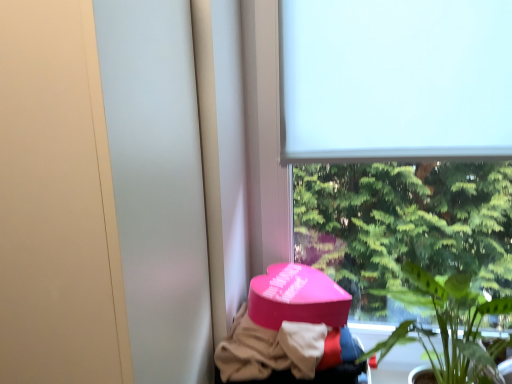
The width and height of the screenshot is (512, 384). Identify the location of white matte window at upper center. (387, 76).

What do you see at coordinates (449, 329) in the screenshot? The image size is (512, 384). I see `green leafy plant at lower right` at bounding box center [449, 329].

The width and height of the screenshot is (512, 384). I want to click on white matte window at upper center, so click(x=387, y=76).

From the image's perspective, which one is positioned lower, white matte window screen at upper center or green leafy plant at lower right?

green leafy plant at lower right, from the image's perspective.

Which of these two, white matte window screen at upper center or green leafy plant at lower right, is smaller?

Smaller between the two is white matte window screen at upper center.

From a real-world perspective, is white matte window screen at upper center under green leafy plant at lower right?

Actually, white matte window screen at upper center is physically above green leafy plant at lower right in the real world.

Can you confirm if green leafy plant at lower right is shorter than white matte window screen at upper center?

No.

From the image's perspective, is green leafy plant at lower right below white matte window screen at upper center?

Yes, from the image's perspective, green leafy plant at lower right is below white matte window screen at upper center.

Is point (465, 331) closer or farther from the camera than point (443, 37)?

Point (465, 331) appears to be closer to the viewer than point (443, 37).

From the image's perspective, which one is positioned higher, white matte window screen at upper center or pink matte heart-shaped box at lower center?

white matte window screen at upper center, from the image's perspective.

Where is `clothing below the white matte window screen at upper center (from the image's perspective)`? This screenshot has height=384, width=512. clothing below the white matte window screen at upper center (from the image's perspective) is located at coordinates (287, 354).

Does white matte window screen at upper center have a lesser width compared to pink matte heart-shaped box at lower center?

Yes, white matte window screen at upper center is thinner than pink matte heart-shaped box at lower center.

From a real-world perspective, is white matte window screen at upper center on top of pink matte heart-shaped box at lower center?

Indeed, from a real-world perspective, white matte window screen at upper center stands above pink matte heart-shaped box at lower center.

Identify the location of window screen on the right of pink matte heart-shaped box at lower center. This screenshot has width=512, height=384. pos(395,79).

What's the angular difference between pink matte heart-shaped box at lower center and white matte window screen at upper center's facing directions?

The facing directions of pink matte heart-shaped box at lower center and white matte window screen at upper center are 0.55 degrees apart.

Is the position of pink matte heart-shaped box at lower center more distant than that of white matte window screen at upper center?

No, it is not.

In terms of height, does pink matte heart-shaped box at lower center look taller or shorter compared to white matte window screen at upper center?

Clearly, pink matte heart-shaped box at lower center is shorter compared to white matte window screen at upper center.

Considering the sizes of objects green leafy plant at lower right and white matte window at upper center in the image provided, who is shorter, green leafy plant at lower right or white matte window at upper center?

Standing shorter between the two is green leafy plant at lower right.

Is green leafy plant at lower right positioned in front of white matte window at upper center?

Yes, green leafy plant at lower right is closer to the camera.

From the image's perspective, is green leafy plant at lower right positioned above or below white matte window at upper center?

Based on their image positions, green leafy plant at lower right is located beneath white matte window at upper center.

Which is nearer, (404,338) or (421,95)?

The point (404,338) is closer to the camera.

From the image's perspective, is white matte window at upper center located above or below green leafy plant at lower right?

Clearly, from the image's perspective, white matte window at upper center is above green leafy plant at lower right.

Considering the sizes of objects white matte window at upper center and green leafy plant at lower right in the image provided, who is smaller, white matte window at upper center or green leafy plant at lower right?

green leafy plant at lower right is smaller.

Is green leafy plant at lower right a part of white matte window at upper center?

No, green leafy plant at lower right is located outside of white matte window at upper center.

Is white matte window at upper center oriented away from green leafy plant at lower right?

Yes, white matte window at upper center's orientation is away from green leafy plant at lower right.

Is pink matte heart-shaped box at lower center beside white matte window at upper center?

No, pink matte heart-shaped box at lower center is not making contact with white matte window at upper center.

Is pink matte heart-shaped box at lower center positioned with its back to white matte window at upper center?

Yes, pink matte heart-shaped box at lower center is positioned with its back facing white matte window at upper center.

From a real-world perspective, between pink matte heart-shaped box at lower center and white matte window at upper center, who is vertically higher?

From a 3D spatial view, white matte window at upper center is above.

Measure the distance between pink matte heart-shaped box at lower center and white matte window at upper center.

15.79 inches.

The image size is (512, 384). What are the coordinates of `window screen located on the left of green leafy plant at lower right` in the screenshot? It's located at (395, 79).

I want to click on window screen above the green leafy plant at lower right (from a real-world perspective), so click(395, 79).

In the scene shown: Which object lies further to the anchor point white matte window screen at upper center, pink matte heart-shaped box at lower center or green leafy plant at lower right?

pink matte heart-shaped box at lower center is positioned further to the anchor white matte window screen at upper center.

From the image, which object appears to be farther from green leafy plant at lower right, white matte window at upper center or pink matte heart-shaped box at lower center?

pink matte heart-shaped box at lower center.

From the image, which object appears to be nearer to white matte window screen at upper center, green leafy plant at lower right or white matte window at upper center?

Among the two, white matte window at upper center is located nearer to white matte window screen at upper center.

Which object lies nearer to the anchor point white matte window at upper center, pink matte heart-shaped box at lower center or green leafy plant at lower right?

green leafy plant at lower right lies closer to white matte window at upper center than the other object.

Considering their positions, is white matte window screen at upper center positioned further to green leafy plant at lower right than pink matte heart-shaped box at lower center?

white matte window screen at upper center is further to green leafy plant at lower right.

Which object lies further to the anchor point pink matte heart-shaped box at lower center, green leafy plant at lower right or white matte window screen at upper center?

white matte window screen at upper center is positioned further to the anchor pink matte heart-shaped box at lower center.

Based on their spatial positions, is white matte window at upper center or white matte window screen at upper center further from green leafy plant at lower right?

white matte window screen at upper center is further to green leafy plant at lower right.

When comparing their distances from pink matte heart-shaped box at lower center, does white matte window at upper center or white matte window screen at upper center seem closer?

white matte window at upper center is closer to pink matte heart-shaped box at lower center.

Find the location of a particular element. The width and height of the screenshot is (512, 384). window that lies between white matte window screen at upper center and green leafy plant at lower right from top to bottom is located at coordinates (387, 76).

The height and width of the screenshot is (384, 512). Identify the location of window between white matte window screen at upper center and pink matte heart-shaped box at lower center in the vertical direction. (387, 76).

Where is `houseplant between white matte window screen at upper center and pink matte heart-shaped box at lower center in the vertical direction`? houseplant between white matte window screen at upper center and pink matte heart-shaped box at lower center in the vertical direction is located at coordinates (449, 329).

Where is `houseplant that lies between white matte window at upper center and pink matte heart-shaped box at lower center from top to bottom`? This screenshot has height=384, width=512. houseplant that lies between white matte window at upper center and pink matte heart-shaped box at lower center from top to bottom is located at coordinates (449, 329).